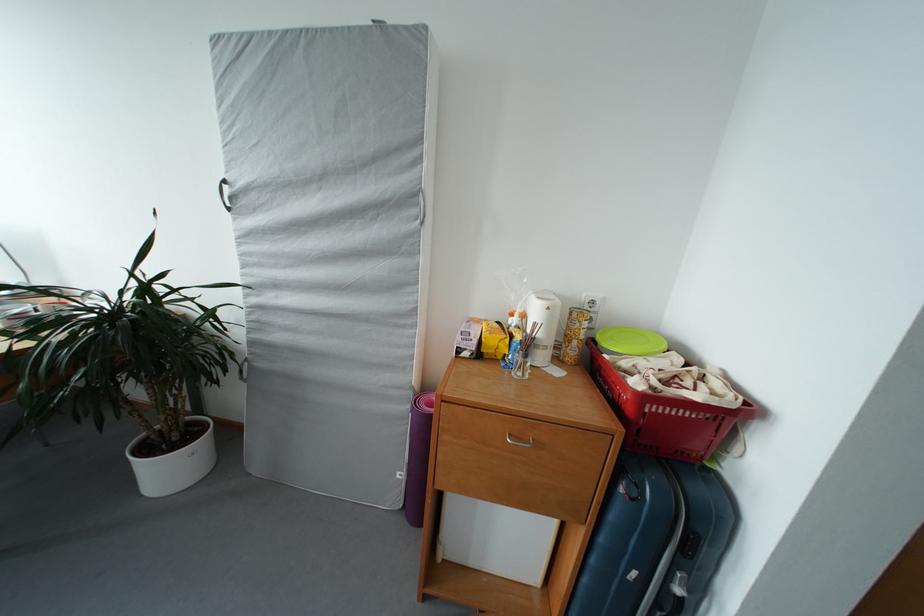
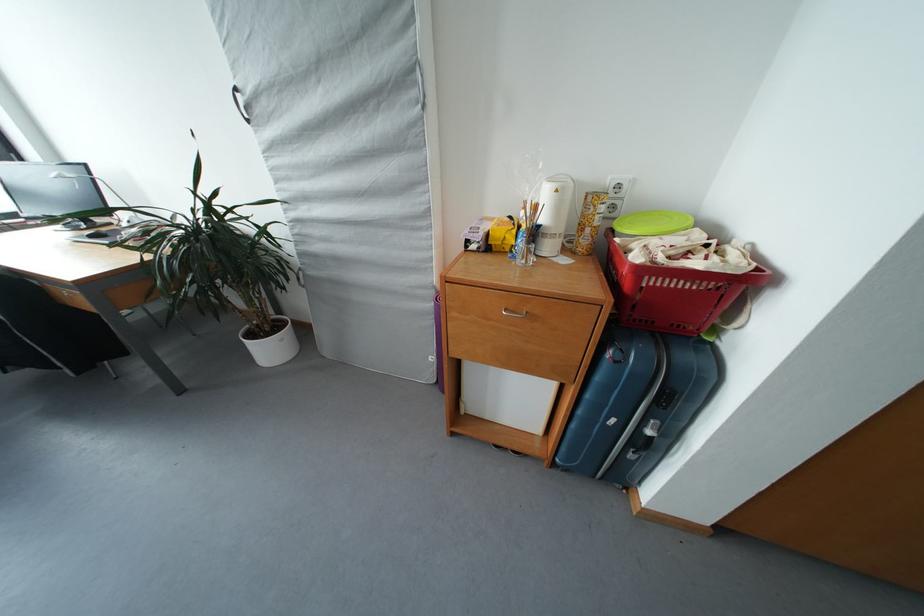
Locate, in the second image, the point that corresponds to point 591,585 in the first image.

(579, 431)